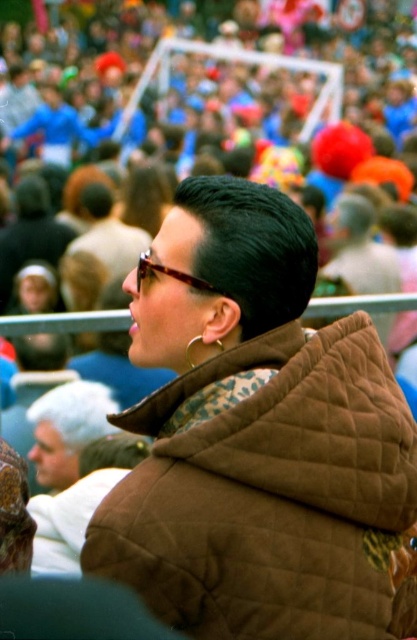
Question: Where is brown quilted jacket at center located in relation to tortoiseshell glasses at center in the image?

Choices:
 (A) right
 (B) left

Answer: (A)

Question: Which point is farther to the camera?

Choices:
 (A) brown quilted jacket at center
 (B) light brown leather jacket at lower left

Answer: (B)

Question: Which of the following is the farthest from the observer?

Choices:
 (A) tortoiseshell glasses at center
 (B) brown quilted jacket at center
 (C) light brown leather jacket at lower left

Answer: (C)

Question: Which of the following is the farthest from the observer?

Choices:
 (A) (158, 268)
 (B) (47, 428)
 (C) (211, 241)

Answer: (B)

Question: From the image, what is the correct spatial relationship of light brown leather jacket at lower left in relation to tortoiseshell glasses at center?

Choices:
 (A) below
 (B) above

Answer: (A)

Question: Is the position of brown quilted jacket at center more distant than that of tortoiseshell glasses at center?

Choices:
 (A) no
 (B) yes

Answer: (A)